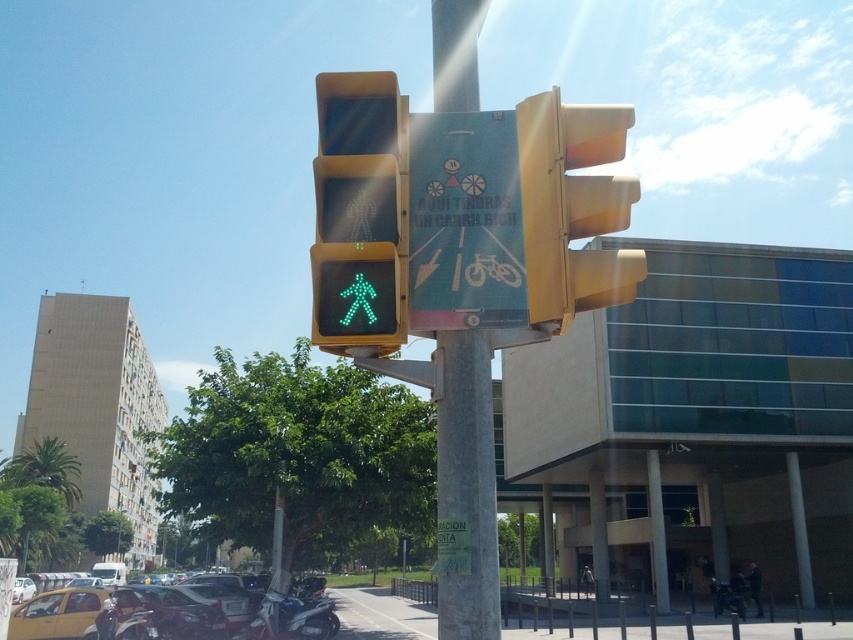
Question: Considering the relative positions of blue paper sign at center and metallic yellow traffic light at upper right in the image provided, where is blue paper sign at center located with respect to metallic yellow traffic light at upper right?

Choices:
 (A) left
 (B) right

Answer: (A)

Question: Is metallic pole at center below yellow matte taxi at lower left?

Choices:
 (A) no
 (B) yes

Answer: (A)

Question: Which point is closer to the camera taking this photo?

Choices:
 (A) (459, 552)
 (B) (242, 609)

Answer: (A)

Question: Among these points, which one is farthest from the camera?

Choices:
 (A) (532, 259)
 (B) (372, 152)

Answer: (A)

Question: Which point is closer to the camera taking this photo?

Choices:
 (A) pyautogui.click(x=358, y=230)
 (B) pyautogui.click(x=463, y=177)
 (C) pyautogui.click(x=450, y=570)

Answer: (C)

Question: From the image, what is the correct spatial relationship of blue paper sign at center in relation to metallic yellow traffic light at upper right?

Choices:
 (A) below
 (B) above

Answer: (A)